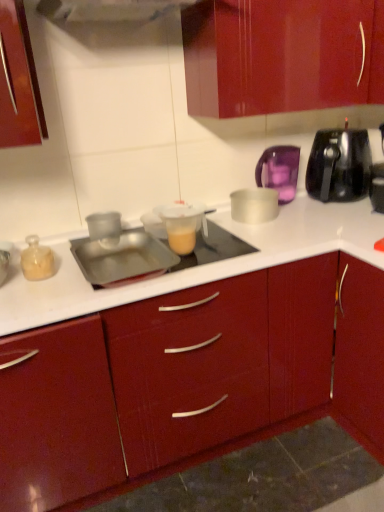
Question: Are translucent glass jar at left, the 5th kitchen appliance positioned from the right, and purple translucent kettle at upper right, the 4th kitchen appliance when ordered from left to right, far apart?

Choices:
 (A) no
 (B) yes

Answer: (B)

Question: Is translucent glass jar at left, which is the 1th kitchen appliance from left to right, touching purple translucent kettle at upper right, the 4th kitchen appliance when ordered from left to right?

Choices:
 (A) no
 (B) yes

Answer: (A)

Question: Is translucent glass jar at left, which is the 1th kitchen appliance from left to right, at the left side of purple translucent kettle at upper right, the second kitchen appliance in the right-to-left sequence?

Choices:
 (A) yes
 (B) no

Answer: (A)

Question: Is translucent glass jar at left, the 5th kitchen appliance positioned from the right, further to the viewer compared to purple translucent kettle at upper right, the second kitchen appliance in the right-to-left sequence?

Choices:
 (A) no
 (B) yes

Answer: (A)

Question: Is translucent glass jar at left, which is the 1th kitchen appliance from left to right, in front of purple translucent kettle at upper right, the 4th kitchen appliance when ordered from left to right?

Choices:
 (A) yes
 (B) no

Answer: (A)

Question: Considering the positions of black plastic toaster at upper right, the 1th kitchen appliance positioned from the right, and translucent plastic measuring cup at center, placed as the first appliance when sorted from right to left, in the image, is black plastic toaster at upper right, the 1th kitchen appliance positioned from the right, taller or shorter than translucent plastic measuring cup at center, placed as the first appliance when sorted from right to left,?

Choices:
 (A) tall
 (B) short

Answer: (A)

Question: Is black plastic toaster at upper right, the 1th kitchen appliance positioned from the right, bigger or smaller than translucent plastic measuring cup at center, placed as the first appliance when sorted from right to left?

Choices:
 (A) small
 (B) big

Answer: (B)

Question: In the image, is black plastic toaster at upper right, the 1th kitchen appliance positioned from the right, on the left side or the right side of translucent plastic measuring cup at center, which appears as the 2th appliance when viewed from the left?

Choices:
 (A) right
 (B) left

Answer: (A)

Question: Relative to translucent plastic measuring cup at center, which appears as the 2th appliance when viewed from the left, is black plastic toaster at upper right, positioned as the 5th kitchen appliance in left-to-right order, in front or behind?

Choices:
 (A) front
 (B) behind

Answer: (B)

Question: Is transparent plastic cup at center, the fourth kitchen appliance viewed from the right, wider or thinner than translucent glass jar at left, the 5th kitchen appliance positioned from the right?

Choices:
 (A) thin
 (B) wide

Answer: (B)

Question: Is transparent plastic cup at center, the fourth kitchen appliance viewed from the right, spatially inside translucent glass jar at left, which is the 1th kitchen appliance from left to right, or outside of it?

Choices:
 (A) outside
 (B) inside

Answer: (A)

Question: Considering the positions of point (119, 216) and point (39, 250), is point (119, 216) closer or farther from the camera than point (39, 250)?

Choices:
 (A) closer
 (B) farther

Answer: (B)

Question: From the image's perspective, is transparent plastic cup at center, the fourth kitchen appliance viewed from the right, positioned above or below translucent glass jar at left, which is the 1th kitchen appliance from left to right?

Choices:
 (A) above
 (B) below

Answer: (A)

Question: From a real-world perspective, is silver metallic bowl at center, positioned as the 3th kitchen appliance in left-to-right order, physically located above or below black plastic toaster at upper right, positioned as the 5th kitchen appliance in left-to-right order?

Choices:
 (A) above
 (B) below

Answer: (B)

Question: In terms of height, does silver metallic bowl at center, positioned as the 3th kitchen appliance in left-to-right order, look taller or shorter compared to black plastic toaster at upper right, positioned as the 5th kitchen appliance in left-to-right order?

Choices:
 (A) tall
 (B) short

Answer: (B)